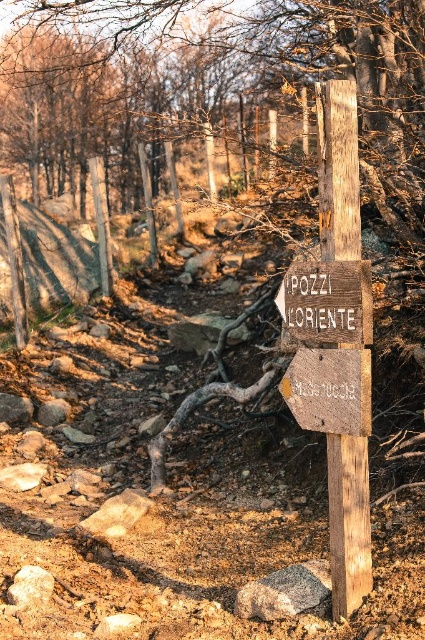
Question: Does wooden signpost at center-right appear on the left side of wooden sign at center?

Choices:
 (A) no
 (B) yes

Answer: (A)

Question: Which point is farther to the camera?

Choices:
 (A) weathered wood sign at center
 (B) wooden signpost at center-right
 (C) wooden sign at center

Answer: (B)

Question: Based on their relative distances, which object is nearer to the weathered wood sign at center?

Choices:
 (A) wooden signpost at center-right
 (B) wooden sign at center

Answer: (B)

Question: Does wooden signpost at center-right appear over wooden sign at center?

Choices:
 (A) no
 (B) yes

Answer: (A)

Question: Is wooden signpost at center-right wider than weathered wood sign at center?

Choices:
 (A) yes
 (B) no

Answer: (B)

Question: Which object is the closest to the weathered wood sign at center?

Choices:
 (A) wooden sign at center
 (B) wooden signpost at center-right

Answer: (A)